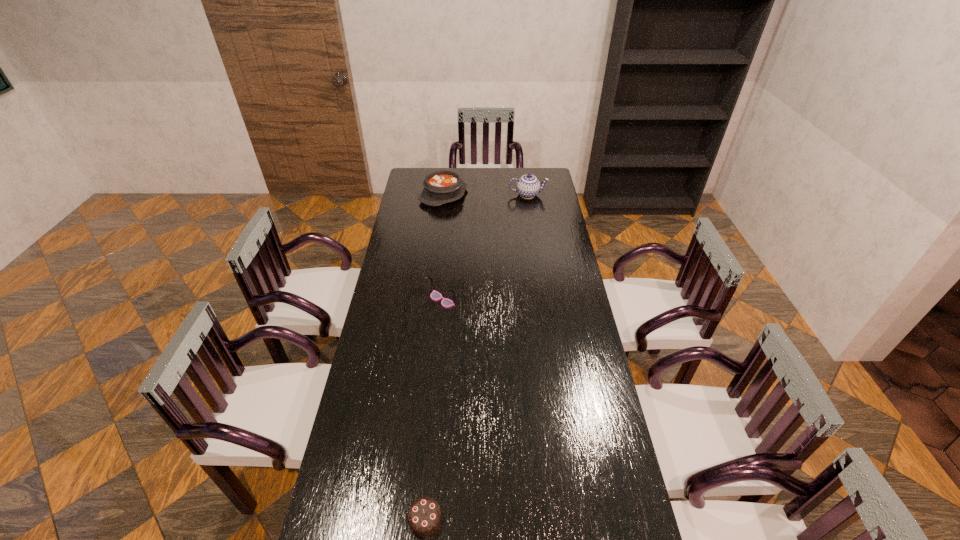
Locate an element on the screen. Image resolution: width=960 pixels, height=540 pixels. the rightmost object is located at coordinates (528, 186).

Identify the location of the tallest object. (528, 186).

This screenshot has width=960, height=540. What are the coordinates of `casserole` in the screenshot? It's located at (443, 186).

Image resolution: width=960 pixels, height=540 pixels. I want to click on spectacles, so click(x=435, y=295).

The height and width of the screenshot is (540, 960). In order to click on the shortest object in this screenshot , I will do pos(424,516).

Find the location of a particular element. chocolate cake is located at coordinates (424, 516).

The width and height of the screenshot is (960, 540). I want to click on free space located at the spout of the chinaware, so click(557, 195).

Locate an element on the screen. Image resolution: width=960 pixels, height=540 pixels. vacant region located on the back of the casserole is located at coordinates (446, 171).

Find the location of `free space located 0.300m on the back of the spectacles`. free space located 0.300m on the back of the spectacles is located at coordinates (446, 247).

Locate an element on the screen. This screenshot has width=960, height=540. free spot located on the right of the chocolate cake is located at coordinates (562, 519).